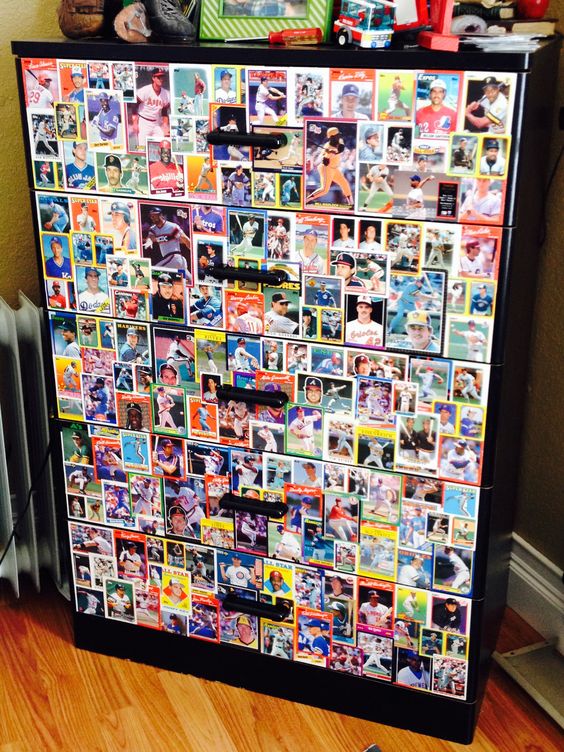
At what (x,y) coordinates should I click in order to perform the action: click on dresser. Please return your answer as a coordinate pair (x, y). The width and height of the screenshot is (564, 752). Looking at the image, I should click on (279, 56).